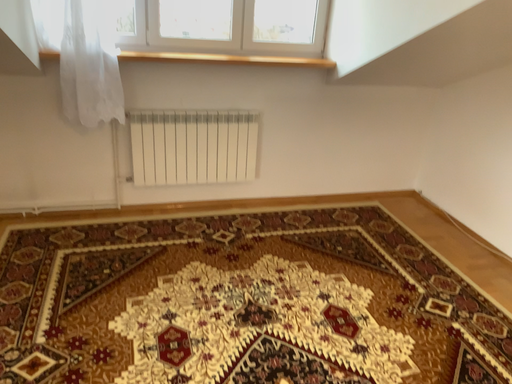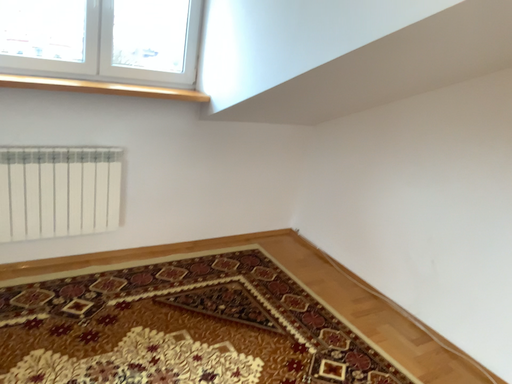
Question: Which way did the camera rotate in the video?

Choices:
 (A) rotated left
 (B) rotated right

Answer: (B)